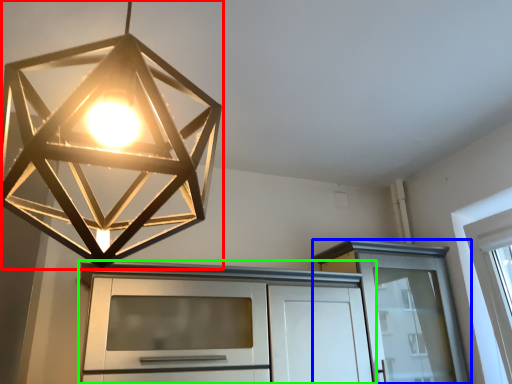
Question: Estimate the real-world distances between objects in this image. Which object is farther from lamp (highlighted by a red box), cabinetry (highlighted by a blue box) or cabinetry (highlighted by a green box)?

Choices:
 (A) cabinetry
 (B) cabinetry

Answer: (A)